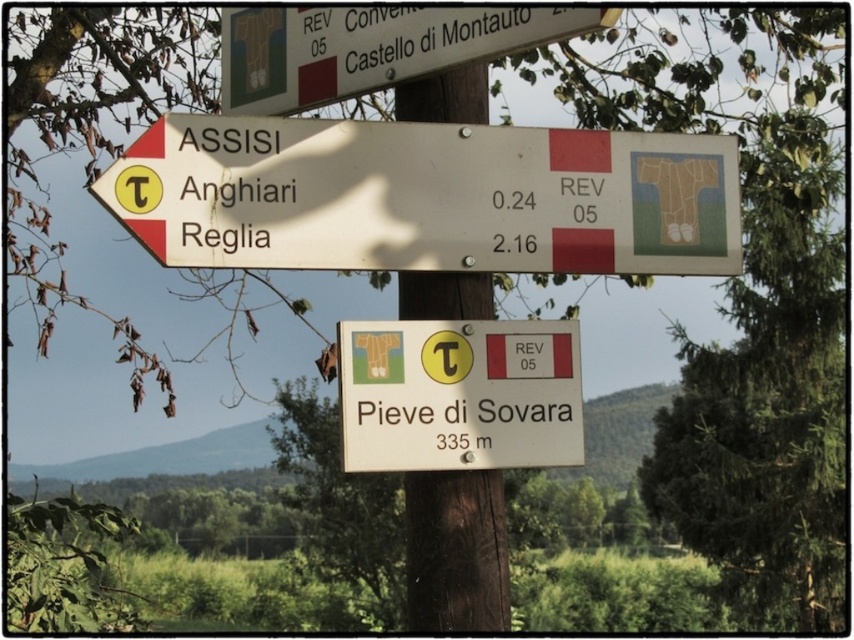
Question: Considering the real-world distances, which object is closest to the white matte sign at upper left?

Choices:
 (A) white plastic sign at center
 (B) brown wood pole at center

Answer: (A)

Question: Considering the relative positions of white matte sign at upper left and brown wood pole at center in the image provided, where is white matte sign at upper left located with respect to brown wood pole at center?

Choices:
 (A) left
 (B) right

Answer: (A)

Question: Which point is farther to the camera?

Choices:
 (A) (309, 38)
 (B) (422, 400)

Answer: (A)

Question: Which point appears closest to the camera in this image?

Choices:
 (A) click(x=398, y=10)
 (B) click(x=416, y=611)

Answer: (B)

Question: Can you confirm if white matte sign at upper left is smaller than white plastic sign at center?

Choices:
 (A) no
 (B) yes

Answer: (A)

Question: Does white plastic sign at center have a lesser width compared to brown wood pole at center?

Choices:
 (A) yes
 (B) no

Answer: (B)